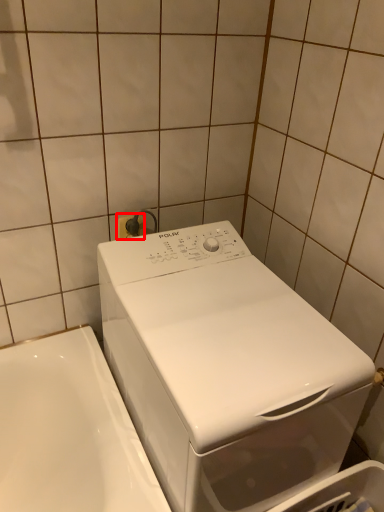
Question: Where is electric outlet (annotated by the red box) located in relation to washing machine in the image?

Choices:
 (A) left
 (B) right

Answer: (A)